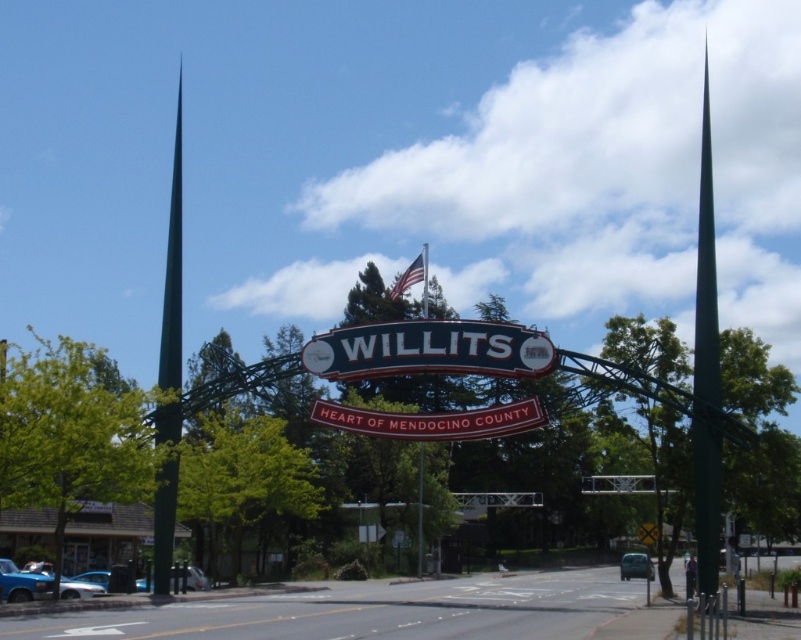
Who is more distant from viewer, (698, 272) or (171, 330)?

Point (171, 330)

Can you confirm if green metallic spire at right is smaller than green metallic spire at left?

Incorrect, green metallic spire at right is not smaller in size than green metallic spire at left.

Locate an element on the screen. The image size is (801, 640). green metallic spire at right is located at coordinates (706, 376).

Locate an element on the screen. This screenshot has width=801, height=640. green metallic spire at right is located at coordinates (706, 376).

Which is in front, point (335, 365) or point (492, 406)?

Point (492, 406) is more forward.

Which of these two, metallic blue sign at center or red matte sign at center, stands shorter?

red matte sign at center

Measure the distance between point (321, 372) and camera.

Point (321, 372) is 70.85 meters from camera.

The image size is (801, 640). I want to click on metallic blue sign at center, so click(x=429, y=349).

Does metallic blue sign at center appear under green metallic spire at right?

Correct, metallic blue sign at center is located below green metallic spire at right.

Locate an element on the screen. The width and height of the screenshot is (801, 640). metallic blue sign at center is located at coordinates (429, 349).